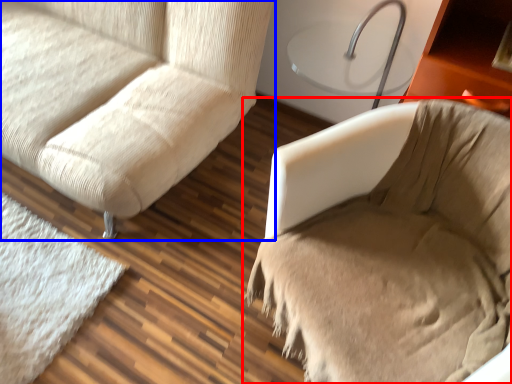
Question: Which object appears closest to the camera in this image, furniture (highlighted by a red box) or studio couch (highlighted by a blue box)?

Choices:
 (A) furniture
 (B) studio couch

Answer: (A)